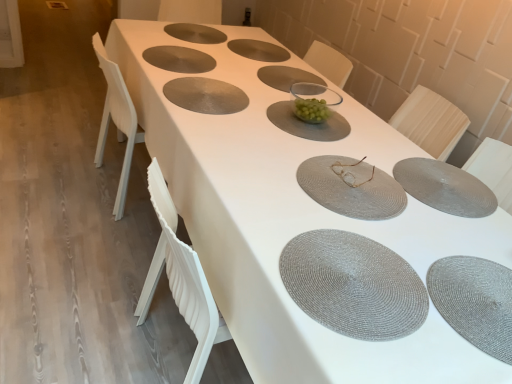
Where is `empty space that is ontop of gray woven placemat at lower right, acting as the 9th tableware starting from the top (from a real-world perspective)`? empty space that is ontop of gray woven placemat at lower right, acting as the 9th tableware starting from the top (from a real-world perspective) is located at coordinates (478, 291).